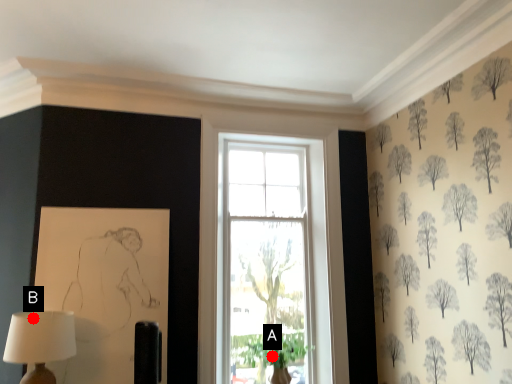
Question: Two points are circled on the image, labeled by A and B beside each circle. Which of the following is the farthest from the observer?

Choices:
 (A) A is further
 (B) B is further

Answer: (A)